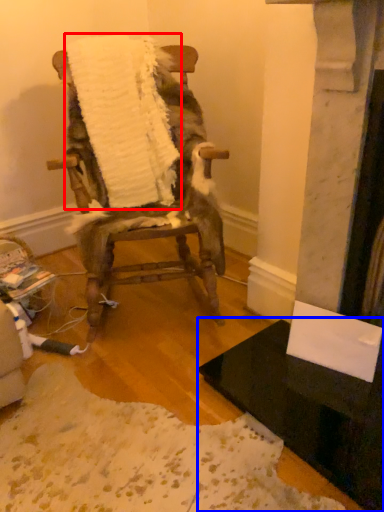
Question: Which object appears farthest to the camera in this image, blanket (highlighted by a red box) or table (highlighted by a blue box)?

Choices:
 (A) blanket
 (B) table

Answer: (A)